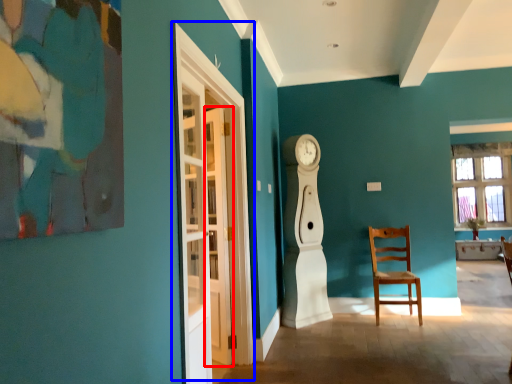
Question: Which object appears closest to the camera in this image, door (highlighted by a red box) or glass door (highlighted by a blue box)?

Choices:
 (A) door
 (B) glass door

Answer: (B)